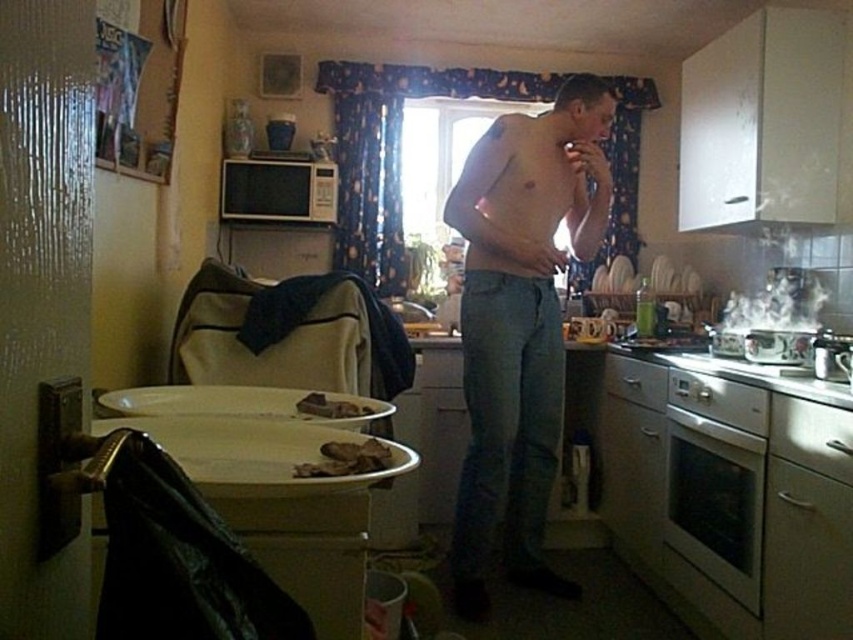
Which is above, muscular flesh at center or white matte microwave at upper center?

white matte microwave at upper center is above.

Looking at this image, is muscular flesh at center positioned in front of white matte microwave at upper center?

Yes, it is in front of white matte microwave at upper center.

Who is more distant from viewer, (563, 211) or (236, 179)?

The point (236, 179) is behind.

Locate an element on the screen. muscular flesh at center is located at coordinates (514, 196).

Is the position of beige fabric laundry at center more distant than that of white glossy oven at lower right?

Yes, beige fabric laundry at center is behind white glossy oven at lower right.

Who is shorter, beige fabric laundry at center or white glossy oven at lower right?

beige fabric laundry at center

Is point (212, 378) positioned after point (743, 497)?

No, (212, 378) is closer to viewer.

Image resolution: width=853 pixels, height=640 pixels. Identify the location of beige fabric laundry at center. (288, 333).

Between black leather jacket at lower left and brown crumbly bread at center, which one is positioned higher?

Positioned higher is black leather jacket at lower left.

Is point (149, 506) closer to camera compared to point (294, 403)?

That is True.

Between point (125, 570) and point (321, 401), which one is positioned behind?

Point (321, 401)

Identify the location of black leather jacket at lower left. The image size is (853, 640). (175, 556).